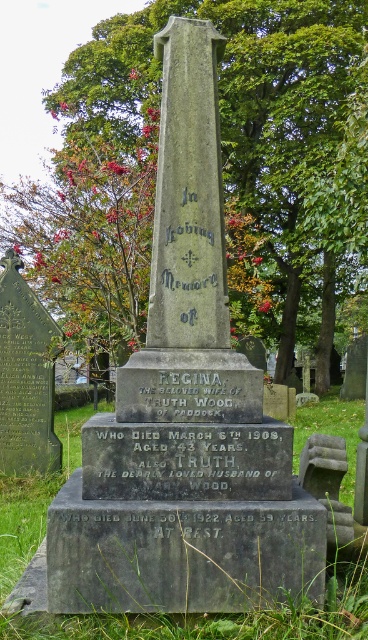
You are standing in a cemetery and see the green leafy tree at center and the green grass at center. Which one is higher?

The green leafy tree at center is located above the green grass at center, so it is higher.

You are standing at the entrance of the cemetery and see the gravestone with the green leafy tree at center and the green grass at center. Which object is taller?

The green leafy tree at center is much taller than the green grass at center.